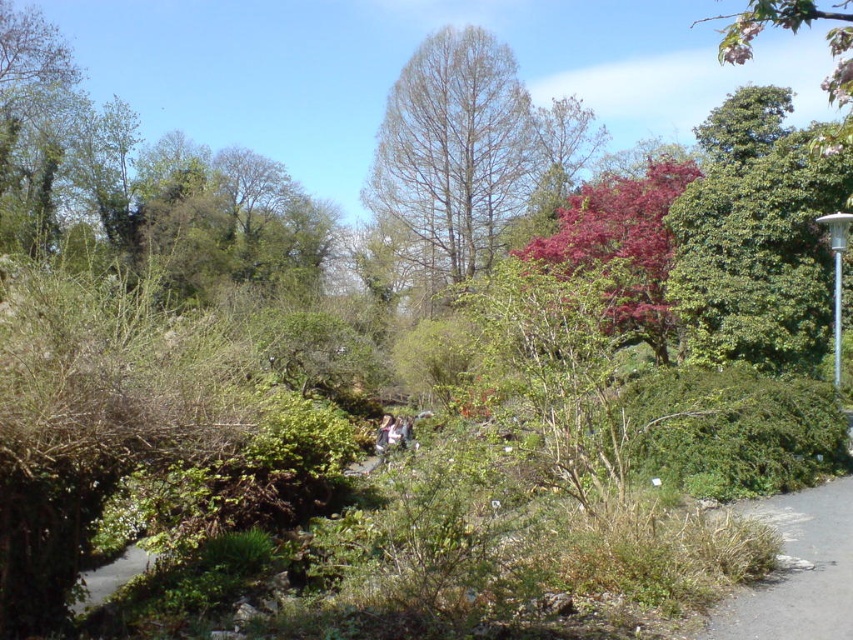
What do you see at coordinates (451, 154) in the screenshot?
I see `bare branches tree at center` at bounding box center [451, 154].

Which is behind, point (482, 44) or point (387, 442)?

Point (482, 44)

Find the location of a particular element. The width and height of the screenshot is (853, 640). bare branches tree at center is located at coordinates (451, 154).

Does gray asphalt path at lower right have a lesser width compared to light brown leather jacket at center?

Incorrect, gray asphalt path at lower right's width is not less than light brown leather jacket at center's.

Can you confirm if gray asphalt path at lower right is positioned to the right of light brown leather jacket at center?

Indeed, gray asphalt path at lower right is positioned on the right side of light brown leather jacket at center.

Identify the location of gray asphalt path at lower right. (796, 572).

Does pink blossoms at upper right have a lesser width compared to light brown hair at center?

Incorrect, pink blossoms at upper right's width is not less than light brown hair at center's.

Is pink blossoms at upper right wider than light brown hair at center?

Correct, the width of pink blossoms at upper right exceeds that of light brown hair at center.

The image size is (853, 640). I want to click on pink blossoms at upper right, so click(793, 33).